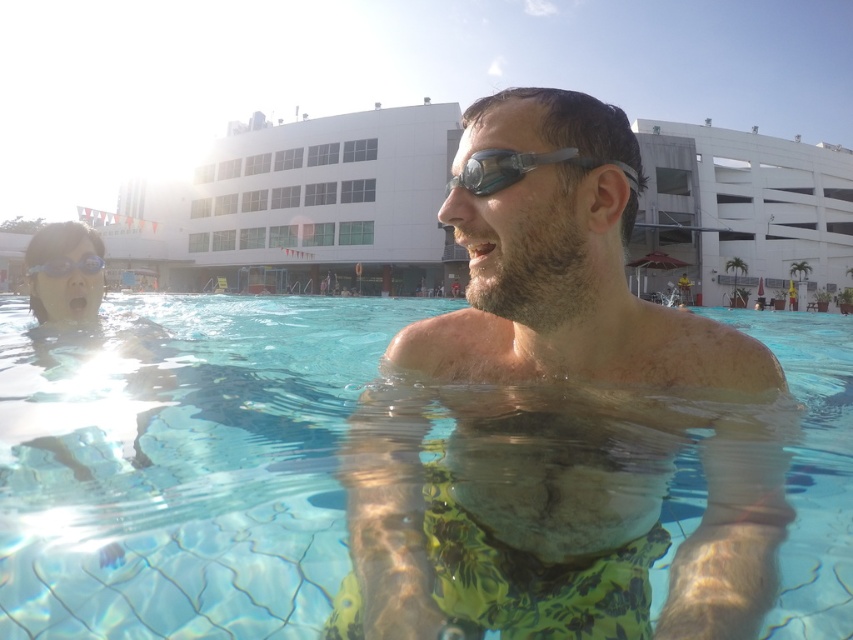
Question: Can you confirm if transparent silicone goggles at center is wider than transparent plastic goggles at upper center?

Choices:
 (A) no
 (B) yes

Answer: (A)

Question: Does transparent plastic water at center have a larger size compared to transparent silicone goggles at center?

Choices:
 (A) no
 (B) yes

Answer: (B)

Question: Which of the following is the closest to the observer?

Choices:
 (A) (573, 150)
 (B) (751, 497)
 (C) (51, 264)
 (D) (82, 353)

Answer: (B)

Question: Which of the following is the closest to the observer?

Choices:
 (A) transparent plastic water at center
 (B) transparent silicone goggles at center
 (C) transparent plastic goggles at upper center
 (D) green floral shorts at center

Answer: (D)

Question: Among these points, which one is nearest to the camera?

Choices:
 (A) (51, 262)
 (B) (515, 156)

Answer: (B)

Question: Can you confirm if green floral shorts at center is smaller than transparent plastic goggles at upper center?

Choices:
 (A) no
 (B) yes

Answer: (A)